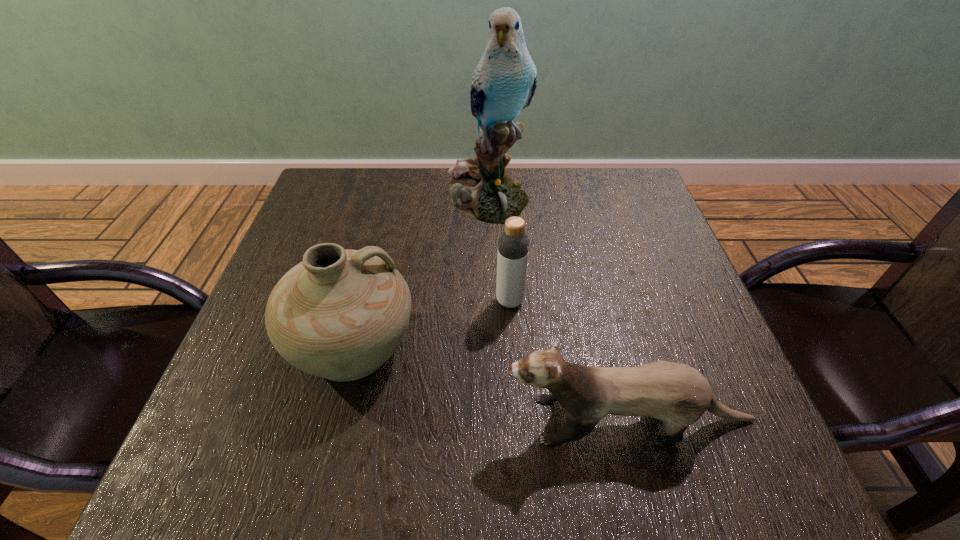
This screenshot has width=960, height=540. I want to click on blank area at the far left corner, so click(x=312, y=219).

Identify the location of blank area at the near left corner. This screenshot has height=540, width=960. (202, 443).

Find the location of a particular element. vacant space at the far right corner of the desktop is located at coordinates (607, 214).

Locate an element on the screen. The image size is (960, 540). vacant region at the near right corner of the desktop is located at coordinates (708, 477).

In order to click on vacant region between the pottery and the ferret in this screenshot , I will do `click(492, 383)`.

The image size is (960, 540). I want to click on vacant area that lies between the ferret and the farthest object, so click(559, 309).

Where is `vacant region between the pottery and the shortest object`? vacant region between the pottery and the shortest object is located at coordinates (492, 383).

The width and height of the screenshot is (960, 540). In order to click on vacant space that's between the parakeet and the shortest object in this screenshot , I will do `click(559, 309)`.

This screenshot has height=540, width=960. I want to click on vacant space that's between the parakeet and the leftmost object, so click(420, 273).

Image resolution: width=960 pixels, height=540 pixels. What are the coordinates of `vacant point located between the bottle and the leftmost object` in the screenshot? It's located at (432, 323).